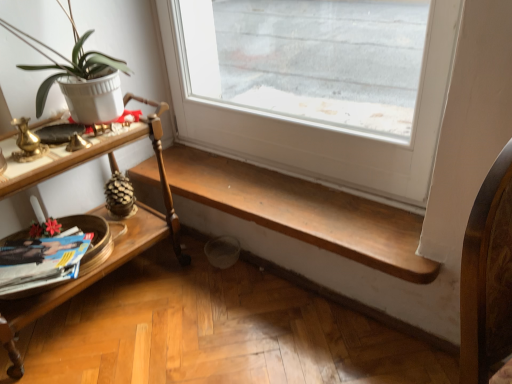
In order to face matte paper magazine at lower left, should I rotate leftwards or rightwards?

Rotate your view left by about 28.083°.

Measure the distance between wooden bench at lower center and camera.

They are 1.21 meters apart.

This screenshot has height=384, width=512. In order to click on woodenmaterial/textureshelf at left in this screenshot , I will do pyautogui.click(x=113, y=240).

The height and width of the screenshot is (384, 512). I want to click on matte paper magazine at lower left, so click(41, 262).

Between wooden bench at lower center and matte paper magazine at lower left, which one has larger width?

matte paper magazine at lower left.

Is wooden bench at lower center beside matte paper magazine at lower left?

wooden bench at lower center and matte paper magazine at lower left are clearly separated.

Where is `magazine lying on the left of wooden bench at lower center`? The width and height of the screenshot is (512, 384). magazine lying on the left of wooden bench at lower center is located at coordinates (41, 262).

From a real-world perspective, who is located higher, wooden bench at lower center or matte paper magazine at lower left?

matte paper magazine at lower left is physically above.

Is woodenmaterial/textureshelf at left facing towards wooden bench at lower center?

No, woodenmaterial/textureshelf at left does not turn towards wooden bench at lower center.

In the image, is woodenmaterial/textureshelf at left on the left side or the right side of wooden bench at lower center?

woodenmaterial/textureshelf at left is positioned on wooden bench at lower center's left side.

Considering the positions of point (22, 370) and point (349, 207), is point (22, 370) closer or farther from the camera than point (349, 207)?

Point (22, 370) is positioned closer to the camera compared to point (349, 207).

Which of these two, woodenmaterial/textureshelf at left or wooden bench at lower center, stands shorter?

With less height is wooden bench at lower center.

From the image's perspective, between woodenmaterial/textureshelf at left and matte paper magazine at lower left, who is located below?

matte paper magazine at lower left.

Is woodenmaterial/textureshelf at left oriented towards matte paper magazine at lower left?

Yes, woodenmaterial/textureshelf at left is facing matte paper magazine at lower left.

How much distance is there between woodenmaterial/textureshelf at left and matte paper magazine at lower left?

The distance of woodenmaterial/textureshelf at left from matte paper magazine at lower left is 7.11 inches.

Image resolution: width=512 pixels, height=384 pixels. What are the coordinates of `shelf above the matte paper magazine at lower left (from the image's perspective)` in the screenshot? It's located at (113, 240).

Identify the location of shelf below the white matte pot at left (from the image's perspective). (113, 240).

Considering the positions of objects white matte pot at left and woodenmaterial/textureshelf at left in the image provided, who is more to the right, white matte pot at left or woodenmaterial/textureshelf at left?

woodenmaterial/textureshelf at left is more to the right.

Considering the sizes of white matte pot at left and woodenmaterial/textureshelf at left in the image, is white matte pot at left wider or thinner than woodenmaterial/textureshelf at left?

white matte pot at left is thinner than woodenmaterial/textureshelf at left.

How different are the orientations of white matte pot at left and woodenmaterial/textureshelf at left in degrees?

There is a 3.77-degree angle between the facing directions of white matte pot at left and woodenmaterial/textureshelf at left.

Is matte paper magazine at lower left positioned beyond the bounds of white matte pot at left?

matte paper magazine at lower left is positioned outside white matte pot at left.

Considering the sizes of matte paper magazine at lower left and white matte pot at left in the image, is matte paper magazine at lower left wider or thinner than white matte pot at left?

In the image, matte paper magazine at lower left appears to be wider than white matte pot at left.

Could you tell me if matte paper magazine at lower left is facing white matte pot at left?

No, matte paper magazine at lower left is not turned towards white matte pot at left.

Based on the photo, considering the positions of objects matte paper magazine at lower left and white matte pot at left in the image provided, who is more to the right, matte paper magazine at lower left or white matte pot at left?

From the viewer's perspective, white matte pot at left appears more on the right side.

From the picture: Does wooden bench at lower center appear on the left side of woodenmaterial/textureshelf at left?

No.

Looking at this image, who is bigger, wooden bench at lower center or woodenmaterial/textureshelf at left?

Bigger between the two is woodenmaterial/textureshelf at left.

From the image's perspective, is wooden bench at lower center located above or below woodenmaterial/textureshelf at left?

wooden bench at lower center is above woodenmaterial/textureshelf at left.

From the image's perspective, relative to white matte pot at left, is woodenmaterial/textureshelf at left above or below?

woodenmaterial/textureshelf at left is situated lower than white matte pot at left in the image.

Which is more to the left, woodenmaterial/textureshelf at left or white matte pot at left?

white matte pot at left.

Is woodenmaterial/textureshelf at left located outside white matte pot at left?

Yes, woodenmaterial/textureshelf at left is not within white matte pot at left.

Where is `magazine positioned vertically above the wooden bench at lower center (from a real-world perspective)`? magazine positioned vertically above the wooden bench at lower center (from a real-world perspective) is located at coordinates (41, 262).

This screenshot has width=512, height=384. I want to click on shelf in front of the wooden bench at lower center, so click(113, 240).

Looking at the image, which one is located closer to white matte pot at left, woodenmaterial/textureshelf at left or matte paper magazine at lower left?

Based on the image, woodenmaterial/textureshelf at left appears to be nearer to white matte pot at left.

Considering their positions, is matte paper magazine at lower left positioned further to white matte pot at left than wooden bench at lower center?

wooden bench at lower center is further to white matte pot at left.

Which object lies further to the anchor point white matte pot at left, wooden bench at lower center or woodenmaterial/textureshelf at left?

Among the two, wooden bench at lower center is located further to white matte pot at left.

Looking at this image, based on their spatial positions, is matte paper magazine at lower left or woodenmaterial/textureshelf at left closer to white matte pot at left?

woodenmaterial/textureshelf at left is positioned closer to the anchor white matte pot at left.

When comparing their distances from white matte pot at left, does wooden bench at lower center or matte paper magazine at lower left seem closer?

Based on the image, matte paper magazine at lower left appears to be nearer to white matte pot at left.

Looking at the image, which one is located further to matte paper magazine at lower left, wooden bench at lower center or white matte pot at left?

wooden bench at lower center is positioned further to the anchor matte paper magazine at lower left.

Based on their spatial positions, is matte paper magazine at lower left or wooden bench at lower center further from woodenmaterial/textureshelf at left?

Among the two, wooden bench at lower center is located further to woodenmaterial/textureshelf at left.

Which object lies nearer to the anchor point wooden bench at lower center, woodenmaterial/textureshelf at left or matte paper magazine at lower left?

Based on the image, woodenmaterial/textureshelf at left appears to be nearer to wooden bench at lower center.

You are a GUI agent. You are given a task and a screenshot of the screen. Output one action in this format:
    pyautogui.click(x=<x>, y=<y>)
    Task: Click on the houseplant situated between matte paper magazine at lower left and wooden bench at lower center from left to right
    This screenshot has width=512, height=384.
    Given the screenshot: What is the action you would take?
    pyautogui.click(x=68, y=61)

Locate an element on the screen. The image size is (512, 384). shelf between white matte pot at left and matte paper magazine at lower left from top to bottom is located at coordinates (113, 240).

Image resolution: width=512 pixels, height=384 pixels. I want to click on shelf situated between matte paper magazine at lower left and wooden bench at lower center from left to right, so click(113, 240).

You are a GUI agent. You are given a task and a screenshot of the screen. Output one action in this format:
    pyautogui.click(x=<x>, y=<y>)
    Task: Click on the shelf between white matte pot at left and wooden bench at lower center in the horizontal direction
    This screenshot has height=384, width=512.
    Given the screenshot: What is the action you would take?
    pyautogui.click(x=113, y=240)